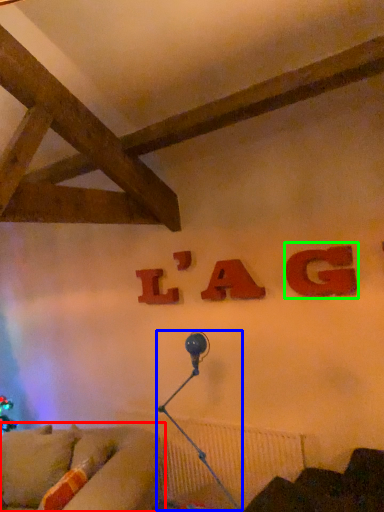
Question: Which object is positioned closest to studio couch (highlighted by a red box)? Select from lamp (highlighted by a blue box) and alphabet (highlighted by a green box).

Choices:
 (A) lamp
 (B) alphabet

Answer: (A)